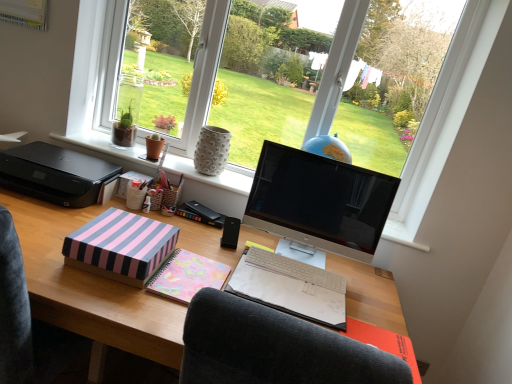
At what (x,y) coordinates should I click in order to perform the action: click on spots to the right of black plastic speaker at center. Please return your answer as a coordinate pair (x, y). Looking at the image, I should click on [268, 249].